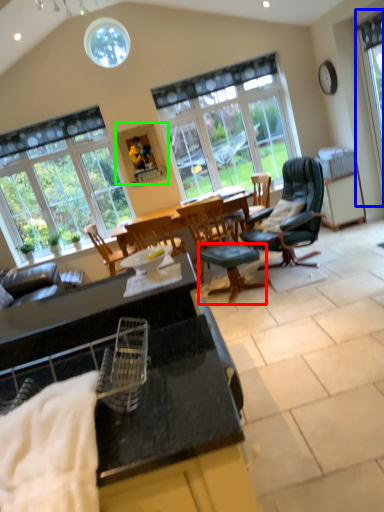
Question: Which object is the farthest from stool (highlighted by a red box)? Choose among these: window (highlighted by a blue box) or picture frame (highlighted by a green box).

Choices:
 (A) window
 (B) picture frame

Answer: (A)